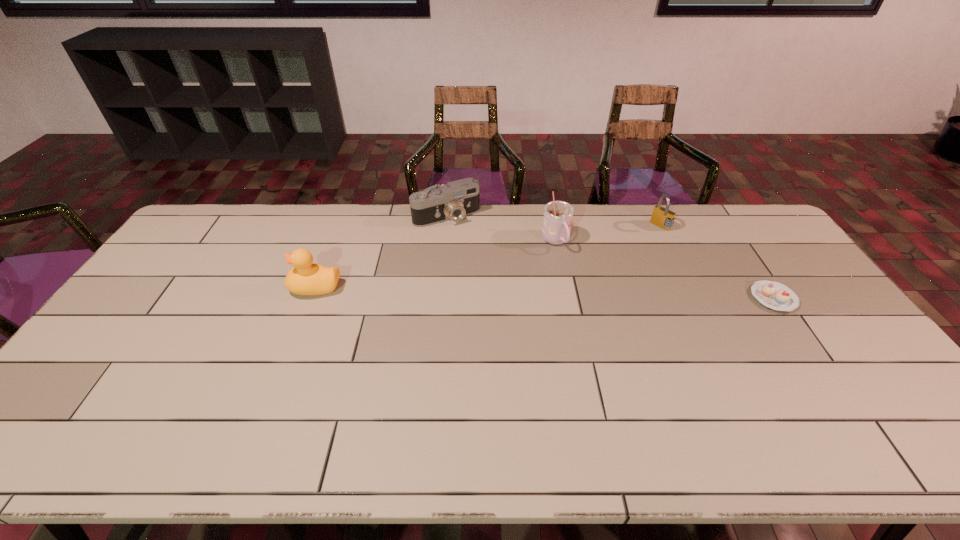
Locate an element on the screen. The image size is (960, 540). free space that is in between the camera and the shortest object is located at coordinates (610, 256).

The height and width of the screenshot is (540, 960). Find the location of `vacant space that is in between the cupcake and the cup`. vacant space that is in between the cupcake and the cup is located at coordinates (664, 269).

At what (x,y) coordinates should I click in order to perform the action: click on vacant area that lies between the padlock and the shortest object. Please return your answer as a coordinate pair (x, y). This screenshot has width=960, height=540. Looking at the image, I should click on (717, 262).

The height and width of the screenshot is (540, 960). Identify the location of free space that is in between the shortest object and the leftmost object. (544, 292).

Where is `empty location between the second object from right to left and the cup`? empty location between the second object from right to left and the cup is located at coordinates (608, 234).

The image size is (960, 540). I want to click on empty space that is in between the cup and the shortest object, so point(664,269).

The height and width of the screenshot is (540, 960). I want to click on vacant point located between the padlock and the shortest object, so click(717, 262).

Identify which object is the third nearest to the duck. Please provide its 2D coordinates. Your answer should be formatted as a tuple, i.e. [(x, y)], where the tuple contains the x and y coordinates of a point satisfying the conditions above.

[(662, 217)]

Choose which object is the nearest neighbor to the padlock. Please provide its 2D coordinates. Your answer should be formatted as a tuple, i.e. [(x, y)], where the tuple contains the x and y coordinates of a point satisfying the conditions above.

[(774, 295)]

I want to click on free region that satisfies the following two spatial constraints: 1. on the front side of the second object from right to left; 2. on the left side of the rightmost object, so click(696, 298).